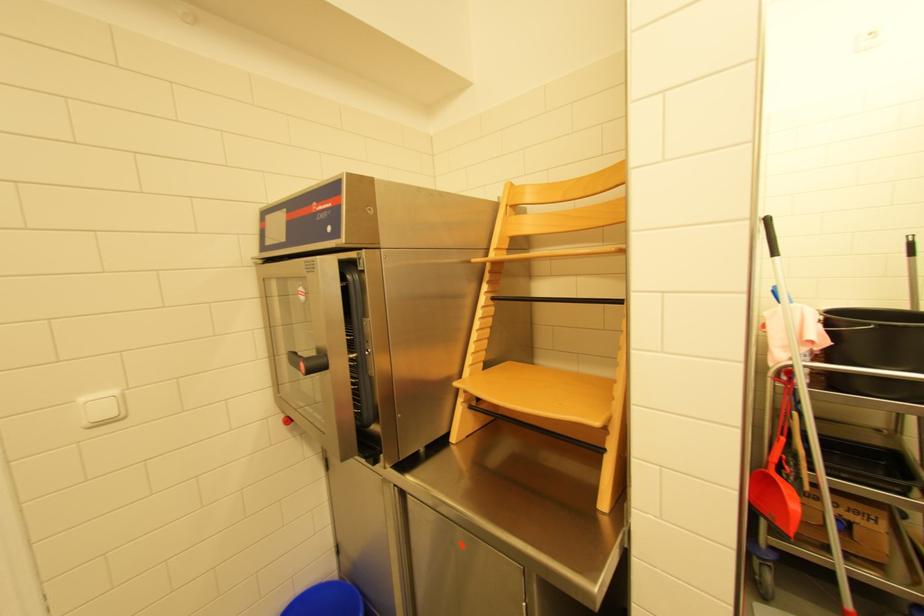
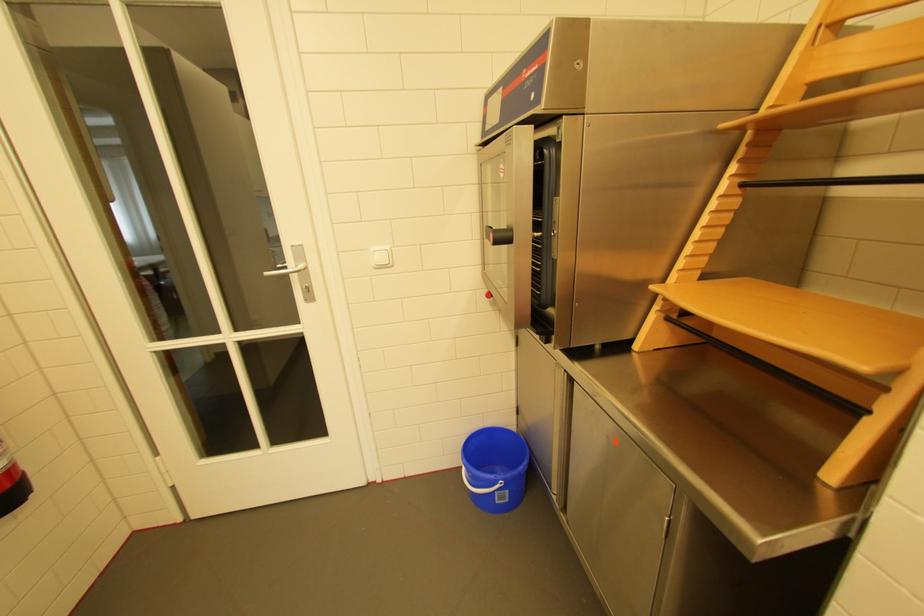
The point at (302,354) is marked in the first image. Where is the corresponding point in the second image?

(499, 229)